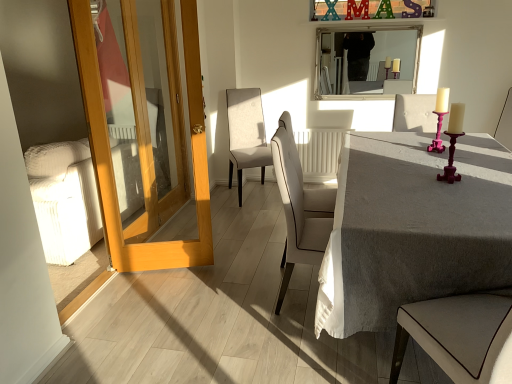
This screenshot has width=512, height=384. What are the coordinates of `vacant space underneath light wood door at left (from a real-world perspective)` in the screenshot? It's located at (160, 270).